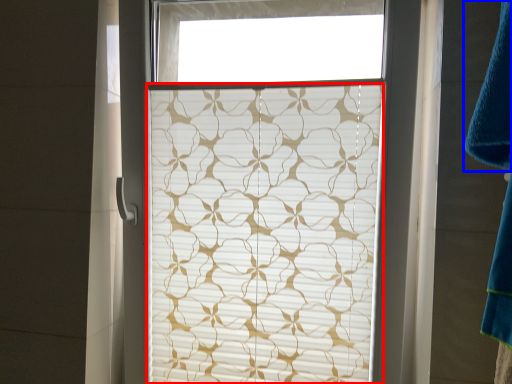
Question: Which object is closer to the camera taking this photo, window blind (highlighted by a red box) or bath towel (highlighted by a blue box)?

Choices:
 (A) window blind
 (B) bath towel

Answer: (B)